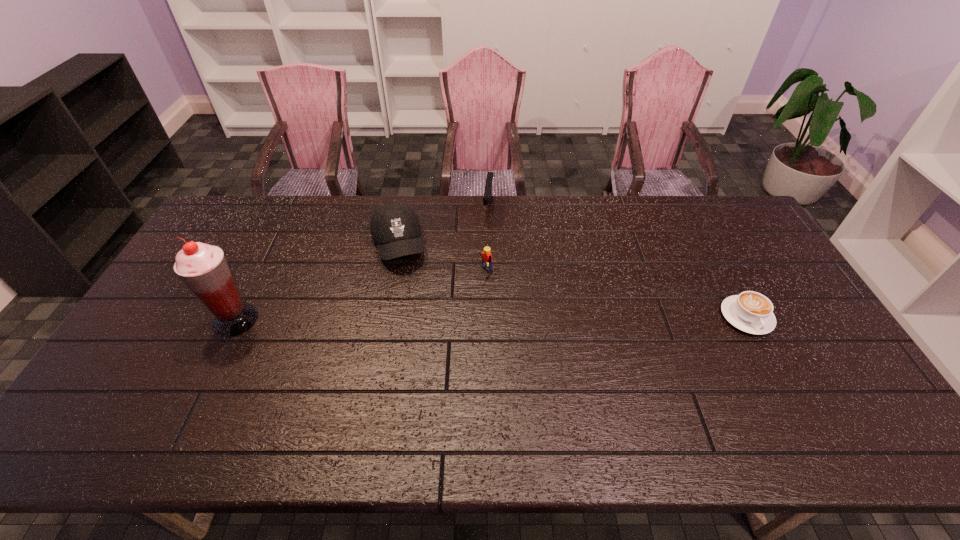
Find the location of a particular element. The height and width of the screenshot is (540, 960). vacant region located 0.080m on the front-facing side of the Lego is located at coordinates tap(463, 292).

Image resolution: width=960 pixels, height=540 pixels. I want to click on vacant space situated on the front-facing side of the Lego, so click(x=389, y=347).

At what (x,y) coordinates should I click in order to perform the action: click on vacant space positioned 0.400m on the front-facing side of the second object from left to right. Please return your answer as a coordinate pair (x, y). This screenshot has width=960, height=540. Looking at the image, I should click on (433, 376).

Where is `free space located 0.350m on the front-facing side of the second object from left to right`? free space located 0.350m on the front-facing side of the second object from left to right is located at coordinates (428, 360).

What are the coordinates of `free space located 0.070m on the front-facing side of the second object from left to right` in the screenshot? It's located at (407, 286).

Where is `blank space located on the front-facing side of the pistol`? Image resolution: width=960 pixels, height=540 pixels. blank space located on the front-facing side of the pistol is located at coordinates (482, 265).

The image size is (960, 540). Find the location of `free point located 0.230m on the front-facing side of the pistol`. free point located 0.230m on the front-facing side of the pistol is located at coordinates (481, 271).

The image size is (960, 540). I want to click on vacant region located on the front-facing side of the pistol, so click(x=484, y=254).

Image resolution: width=960 pixels, height=540 pixels. What are the coordinates of `baseball cap that is at the far edge` in the screenshot? It's located at (395, 227).

Locate an element on the screen. The image size is (960, 540). pistol that is at the far edge is located at coordinates (488, 191).